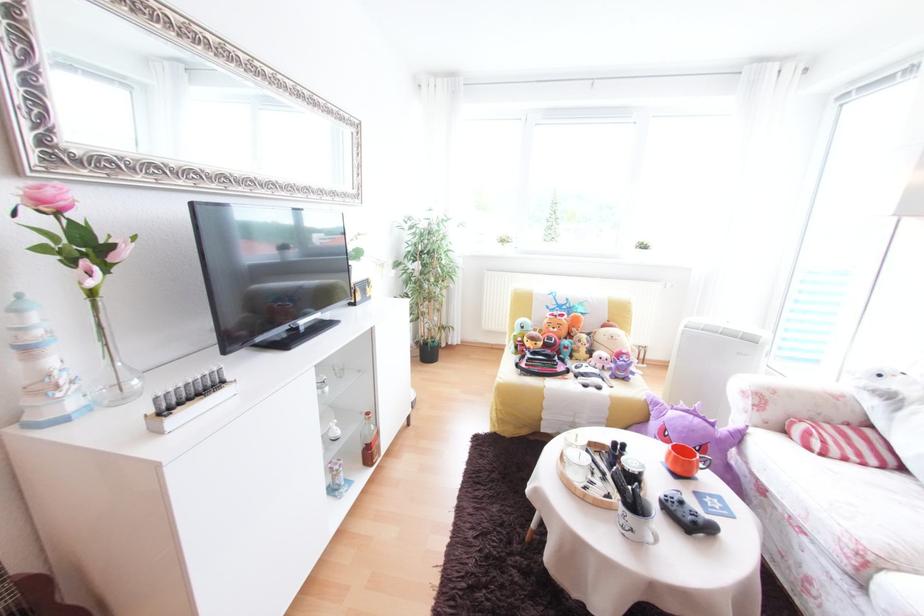
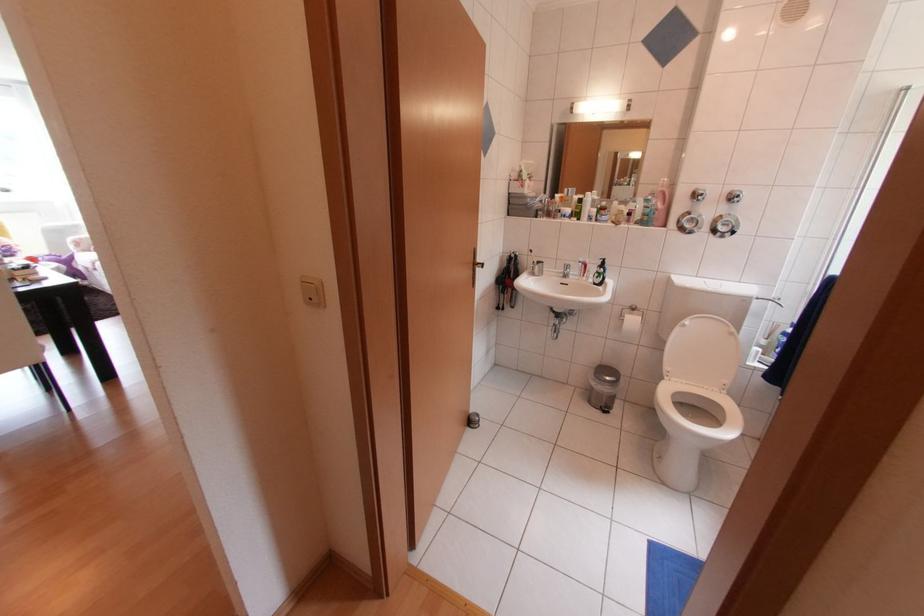
Question: I am providing you with two images of the same scene from different viewpoints. After the viewpoint changes to image2, which objects are now occluded?

Choices:
 (A) brown bottle
 (B) grey game controller
 (C) red toothbrush
 (D) white light switch

Answer: (B)